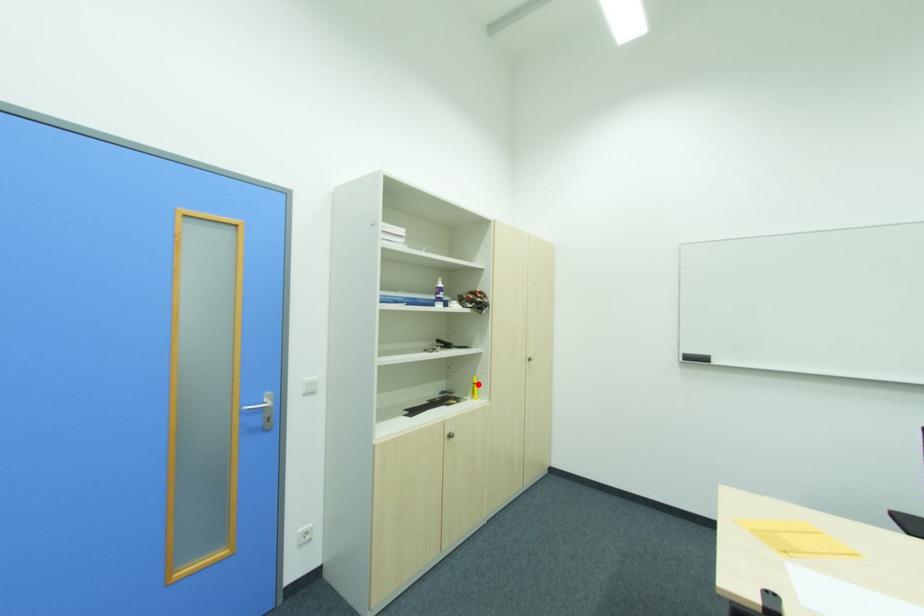
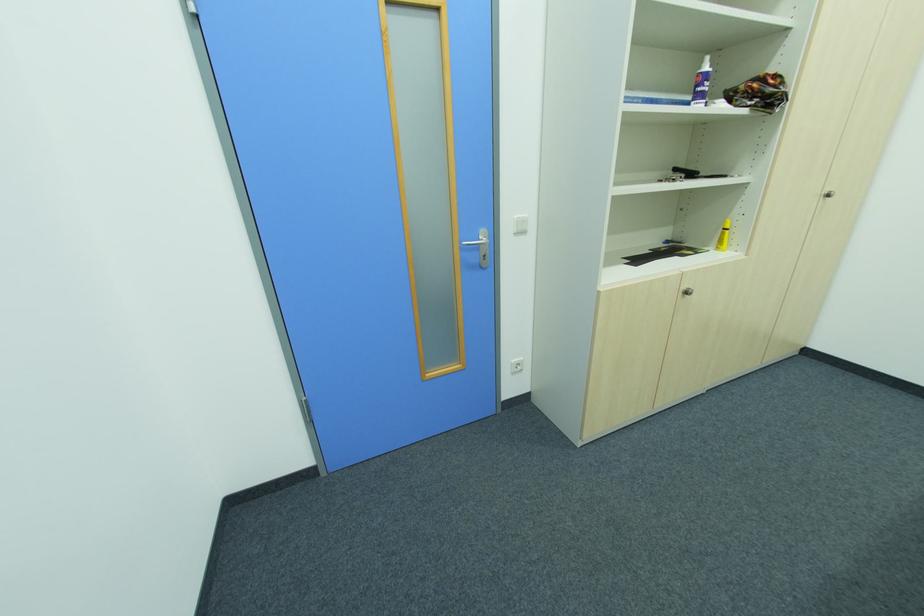
The point at the highlighted location is marked in the first image. Where is the corresponding point in the second image?

(728, 230)